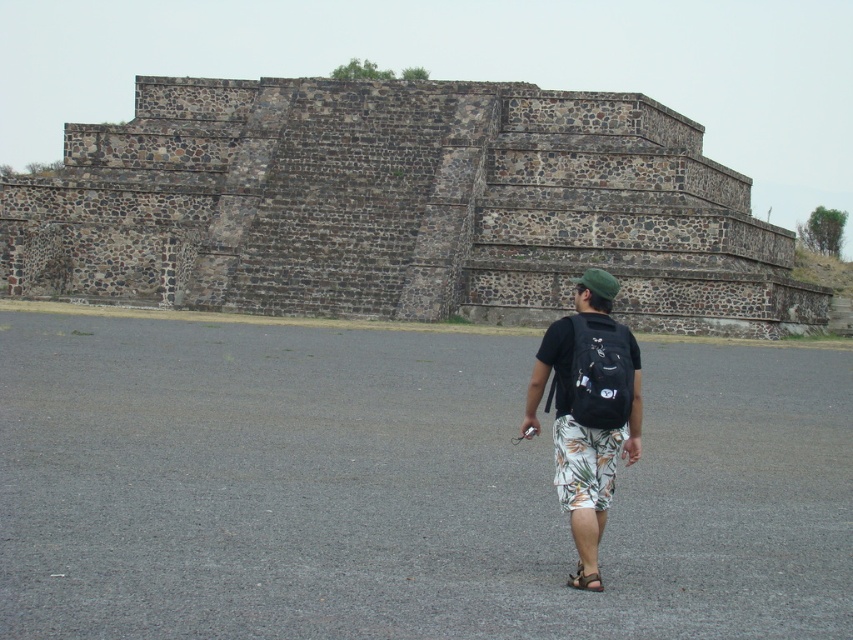
In the scene shown: Does black fabric backpack at center lie behind brown leather sandal at lower center?

Yes, it is.

Is point (625, 340) farther from camera compared to point (581, 588)?

Yes, point (625, 340) is behind point (581, 588).

Does point (624, 333) come closer to viewer compared to point (579, 577)?

No, it is behind (579, 577).

Find the location of `black fabric backpack at center`. black fabric backpack at center is located at coordinates (601, 372).

Who is positioned more to the left, printed cotton shorts at center or brown leather sandal at lower center?

brown leather sandal at lower center

Who is more forward, (619,420) or (578,563)?

Point (578,563) is more forward.

Is point (573, 460) positioned behind point (599, 584)?

Yes, it is.

Identify the location of printed cotton shorts at center. (589, 404).

Is point (206, 296) farther from viewer compared to point (619, 349)?

Yes, point (206, 296) is behind point (619, 349).

Who is more forward, (135, 96) or (583, 374)?

Point (583, 374)

Which is in front, point (300, 216) or point (618, 417)?

Point (618, 417)

Where is `rustic stone pyramid at center`? The height and width of the screenshot is (640, 853). rustic stone pyramid at center is located at coordinates (401, 208).